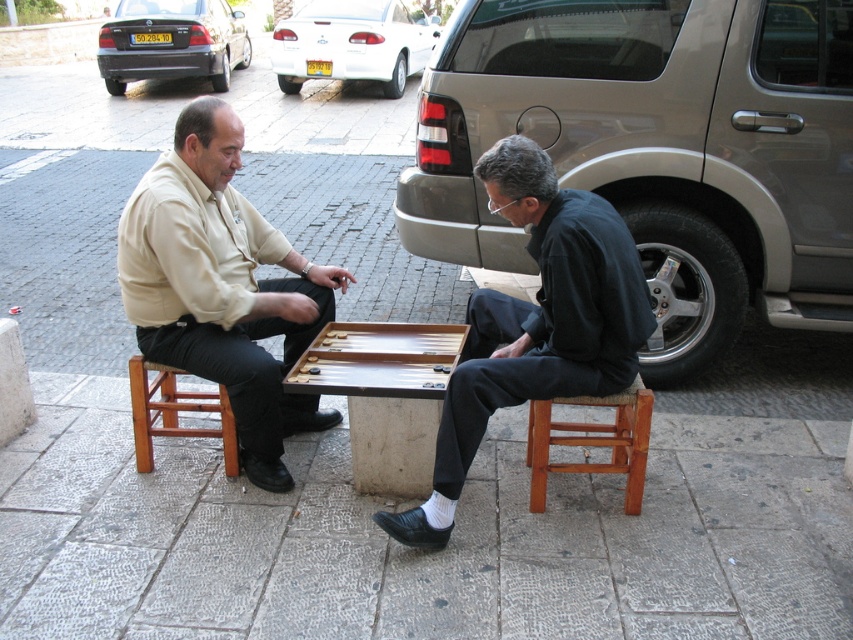
Who is positioned more to the left, dark blue fabric shirt at center or wooden backgammon board at center?

wooden backgammon board at center

Can you confirm if dark blue fabric shirt at center is taller than wooden backgammon board at center?

Indeed, dark blue fabric shirt at center has a greater height compared to wooden backgammon board at center.

Does point (541, 230) come behind point (413, 340)?

No, it is not.

The image size is (853, 640). In order to click on dark blue fabric shirt at center in this screenshot , I will do `click(534, 323)`.

Who is taller, beige cotton shirt at left or wooden stool at left?

beige cotton shirt at left

Is point (300, 289) positioned after point (173, 396)?

No, (300, 289) is closer to viewer.

Where is `beige cotton shirt at left`? The image size is (853, 640). beige cotton shirt at left is located at coordinates (222, 285).

Does beige cotton shirt at left appear over wooden stool at lower right?

Indeed, beige cotton shirt at left is positioned over wooden stool at lower right.

Between point (263, 451) and point (633, 401), which one is positioned behind?

Positioned behind is point (263, 451).

Does point (225, 218) lie behind point (637, 484)?

Yes, it is behind point (637, 484).

In order to click on beige cotton shirt at left in this screenshot , I will do `click(222, 285)`.